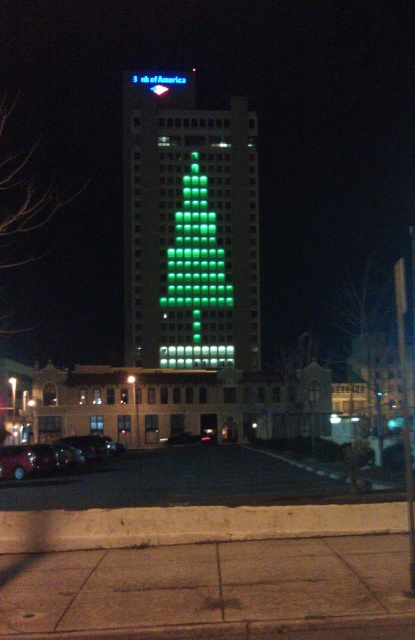
Consider the image. Is shiny black sedan at lower left further to the viewer compared to green led sign at center?

No, it is in front of green led sign at center.

Is shiny black sedan at lower left to the left of green led sign at center from the viewer's perspective?

Indeed, shiny black sedan at lower left is positioned on the left side of green led sign at center.

Locate an element on the screen. The width and height of the screenshot is (415, 640). shiny black sedan at lower left is located at coordinates (94, 445).

Who is positioned more to the left, green led lights at center or shiny red car at lower left?

From the viewer's perspective, green led lights at center appears more on the left side.

Is green led lights at center bigger than shiny red car at lower left?

Yes, green led lights at center is bigger than shiny red car at lower left.

Who is more forward, (x=195, y=349) or (x=21, y=452)?

Point (x=21, y=452) is in front.

Find the location of `green led lights at center`. green led lights at center is located at coordinates (188, 228).

Is green led lights at center behind shiny black sedan at lower left?

Yes, it is behind shiny black sedan at lower left.

Is green led lights at center taller than shiny black sedan at lower left?

Yes, green led lights at center is taller than shiny black sedan at lower left.

Find the location of a particular element. Image resolution: width=415 pixels, height=640 pixels. green led lights at center is located at coordinates (188, 228).

Find the location of a particular element. green led lights at center is located at coordinates (188, 228).